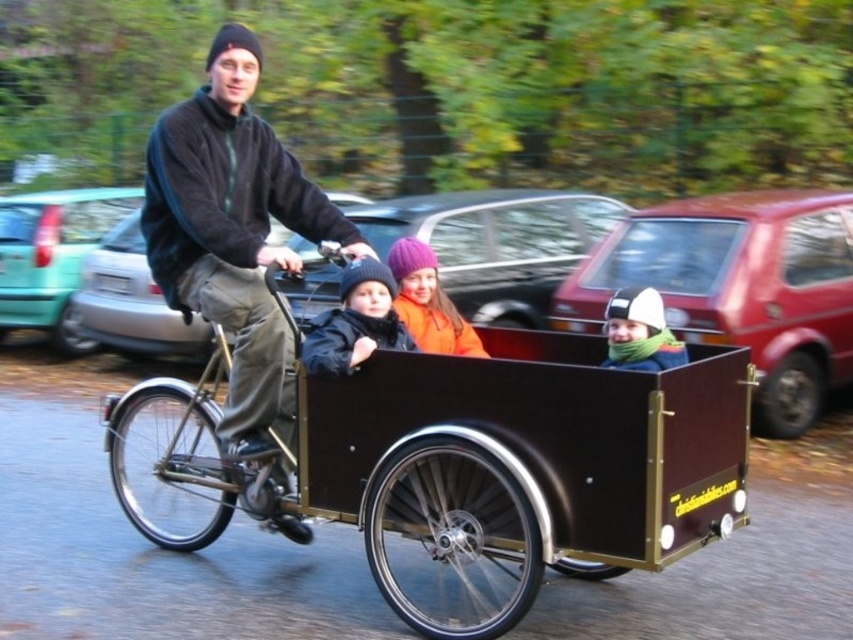
Does brown wooden wagon at center lie in front of matte red car at center?

Yes, it is in front of matte red car at center.

In the scene shown: Between brown wooden wagon at center and matte red car at center, which one appears on the left side from the viewer's perspective?

From the viewer's perspective, brown wooden wagon at center appears more on the left side.

Who is more forward, (x=589, y=400) or (x=764, y=408)?

Point (x=589, y=400)

You are a GUI agent. You are given a task and a screenshot of the screen. Output one action in this format:
    pyautogui.click(x=<x>, y=<y>)
    Task: Click on the brown wooden wagon at center
    
    Given the screenshot: What is the action you would take?
    pyautogui.click(x=457, y=468)

Can you confirm if matte red car at center is taller than dark blue jacket at center?

Result: Yes.

Does point (850, 198) come behind point (349, 280)?

That is True.

Does point (825, 392) come in front of point (368, 292)?

No, it is not.

This screenshot has width=853, height=640. Identify the location of matte red car at center. (740, 288).

Does point (517, 509) come behind point (589, 211)?

That is False.

Does point (393, 589) lie behind point (534, 244)?

No, it is not.

Identify the location of brown wooden wagon at center. (457, 468).